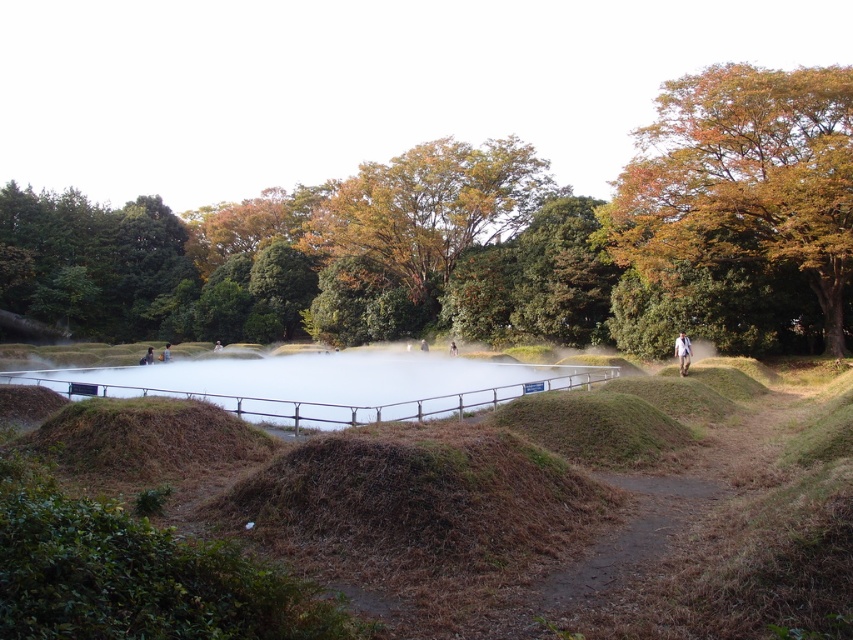
Does point (815, 150) lie behind point (566, 577)?

Yes, it is behind point (566, 577).

Between green leafy tree at upper center and brown dirt path at center, which one appears on the right side from the viewer's perspective?

From the viewer's perspective, brown dirt path at center appears more on the right side.

Is point (791, 156) positioned in front of point (636, 484)?

No, it is not.

Where is `green leafy tree at upper center`? Image resolution: width=853 pixels, height=640 pixels. green leafy tree at upper center is located at coordinates (489, 240).

Does orange leafy tree at upper right appear under white mist at center?

Incorrect, orange leafy tree at upper right is not positioned below white mist at center.

Between point (720, 81) and point (277, 381), which one is positioned behind?

Point (720, 81)

Is point (662, 109) less distant than point (506, 372)?

No, it is behind (506, 372).

Find the location of a particular element. This screenshot has height=640, width=853. orange leafy tree at upper right is located at coordinates (746, 179).

Consider the image. Does brown dirt path at center have a lesser height compared to white fabric person at center?

Correct, brown dirt path at center is not as tall as white fabric person at center.

Is point (664, 540) positioned after point (686, 349)?

No, (664, 540) is in front of (686, 349).

Is point (694, 476) in front of point (677, 349)?

Yes.

At what (x,y) coordinates should I click in order to perform the action: click on brown dirt path at center. Please return your answer as a coordinate pair (x, y). The height and width of the screenshot is (640, 853). Looking at the image, I should click on tap(624, 540).